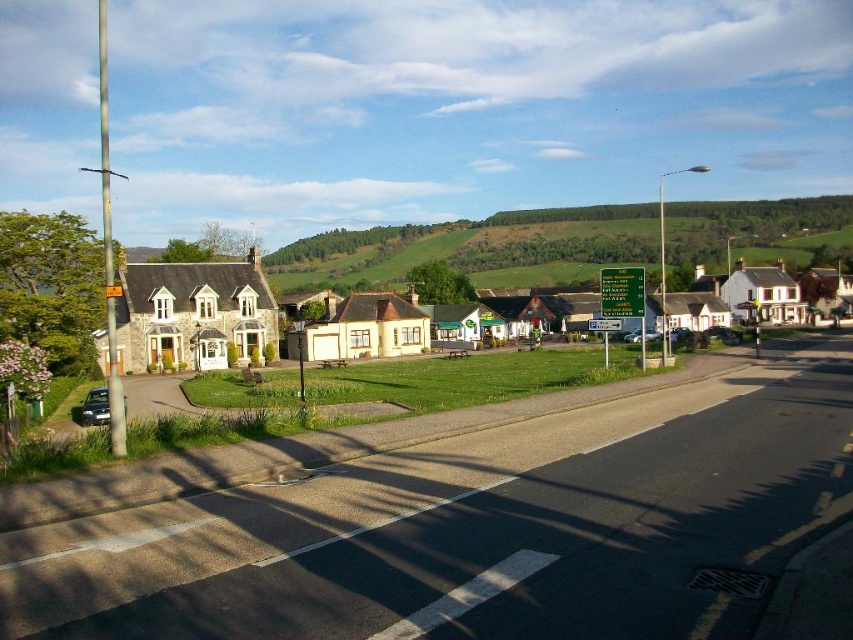
You are standing at the point with coordinates point (x=639, y=275) and want to walk towards the point (x=491, y=285). Which direction should you move?

Since point (x=491, y=285) is further to the viewer than point (x=639, y=275), you should move forward towards it.

You are standing at the origin point of the coordinate system in the scene. You want to walk to the stone house at center. According to the coordinate system, in which direction should you move first?

The stone house at center is located at coordinate point (x=260, y=317). Since the origin is at the bottom left corner, moving towards positive x and y directions would lead towards the center. However, since the x coordinate is 0.498 which is near the middle, and y is 0.306 which is a third up from the bottom, you should move forward in the y direction first to reach the stone house at center.

You are a delivery drone flying over a rural village. You need to deliver a package to the green plastic sign at center which is 77.45 meters away from the green grassy hillside at center. If your drone can travel 100 meters before needing to recharge, will you be able to make the delivery without recharging?

The distance between the green grassy hillside at center and the green plastic sign at center is 77.45 meters. Since the drone can travel 100 meters before needing to recharge, it can make the delivery without recharging as the distance is within the drone s range.